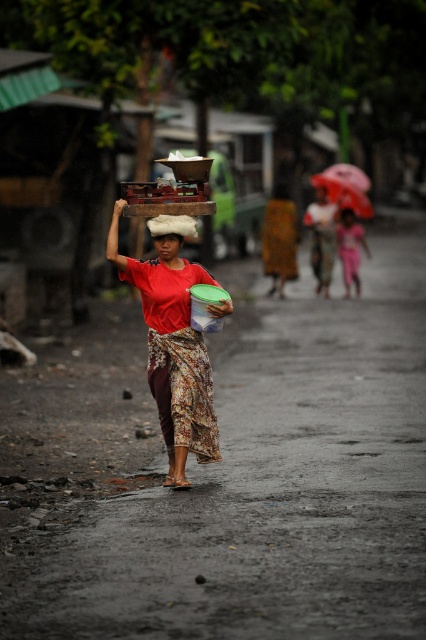
Question: Does matte red shirt at center appear on the left side of red fabric umbrella at upper right?

Choices:
 (A) no
 (B) yes

Answer: (B)

Question: Which point is closer to the camera?

Choices:
 (A) smooth plastic head at center
 (B) matte red shirt at center

Answer: (B)

Question: Can you confirm if red fabric umbrella at upper right is wider than smooth plastic head at center?

Choices:
 (A) yes
 (B) no

Answer: (A)

Question: Which point appears closest to the camera in this image?

Choices:
 (A) (181, 420)
 (B) (336, 168)

Answer: (A)

Question: Considering the real-world distances, which object is closest to the red fabric umbrella at upper right?

Choices:
 (A) smooth plastic head at center
 (B) matte red shirt at center

Answer: (A)

Question: In this image, where is red fabric umbrella at upper right located relative to smooth plastic head at center?

Choices:
 (A) right
 (B) left

Answer: (A)